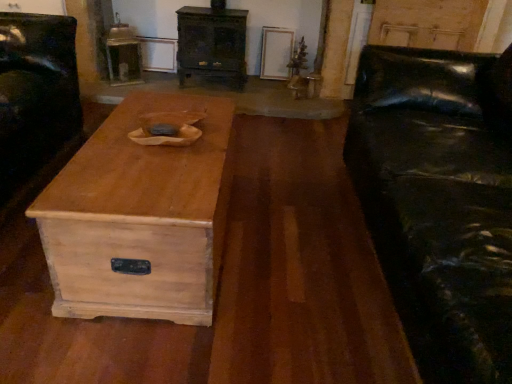
I want to click on vacant region above light brown wood coffee table at center (from a real-world perspective), so click(x=159, y=147).